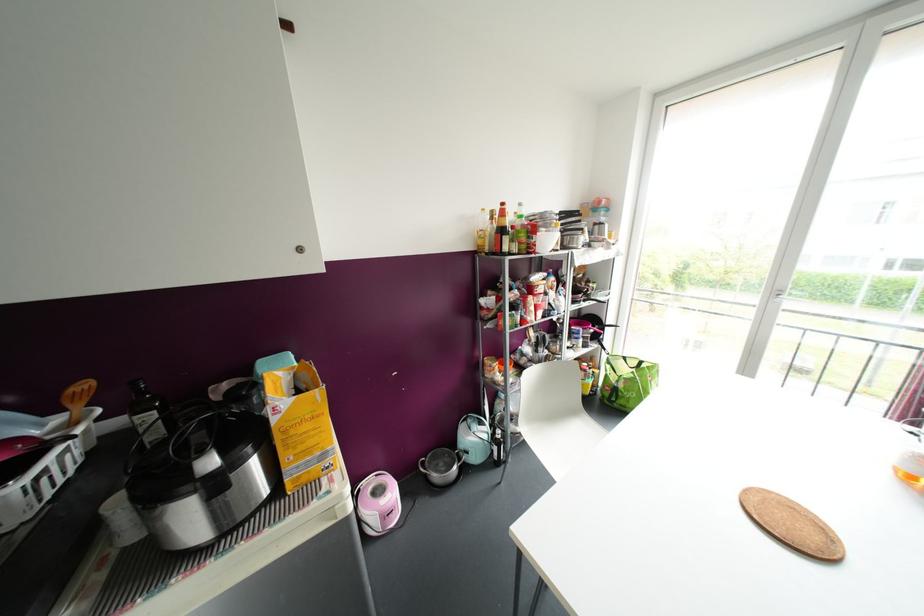
This screenshot has height=616, width=924. Identify the location of white bowl. (545, 240).